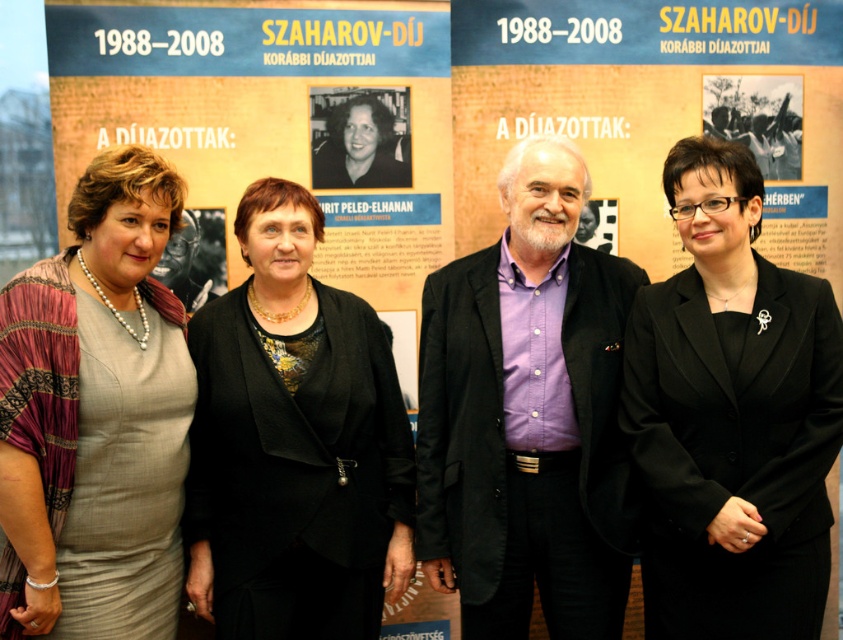
You are a photographer standing 10 feet away from the backdrop. You want to take a photo of the black glossy blazer at center and the matte gray dress at center left without moving the subjects. Can you fit both into your camera frame that has a 5 feet wide field of view?

The black glossy blazer at center is 7.18 feet from the matte gray dress at center left. Since the distance between them exceeds the 5 feet field of view, you cannot fit both into the frame without moving the subjects.

You are a photographer who needs to adjust the lighting for a group photo. The purple cotton shirt at center and the matte gray dress at center left are in your frame. Which clothing item requires more light to ensure it stands out, based on their sizes?

The purple cotton shirt at center requires more light because it is bigger than the matte gray dress at center left, making it more prominent in the frame.

You are standing in front of the backdrop and want to touch both points. Which point should you reach for first, point at (652,577) or point at (72,512)?

You should reach for point at (72,512) first because it is closer to you than point at (652,577), which is further away.